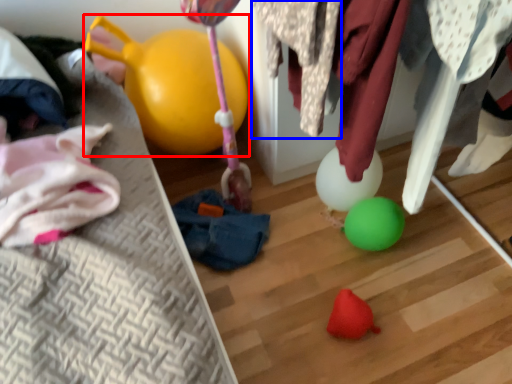
Question: Which of the following is the farthest to the observer, balloon (highlighted by a red box) or clothing (highlighted by a blue box)?

Choices:
 (A) balloon
 (B) clothing

Answer: (A)